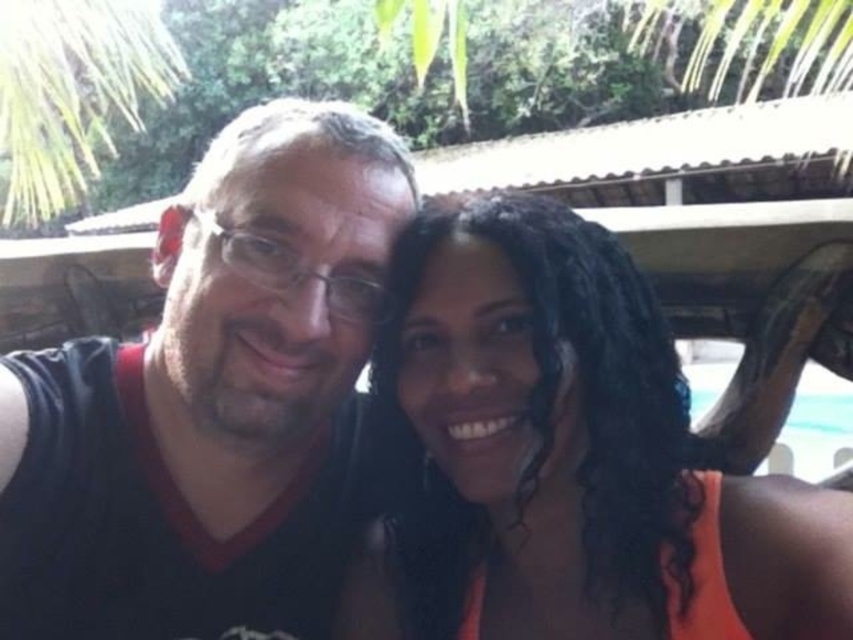
Question: Does orange fabric at center come behind black matte shirt at center?

Choices:
 (A) no
 (B) yes

Answer: (A)

Question: Can you confirm if orange fabric at center is bigger than black matte shirt at center?

Choices:
 (A) no
 (B) yes

Answer: (B)

Question: Among these points, which one is nearest to the camera?

Choices:
 (A) (190, 369)
 (B) (492, 476)

Answer: (B)

Question: Is orange fabric at center bigger than black matte shirt at center?

Choices:
 (A) no
 (B) yes

Answer: (B)